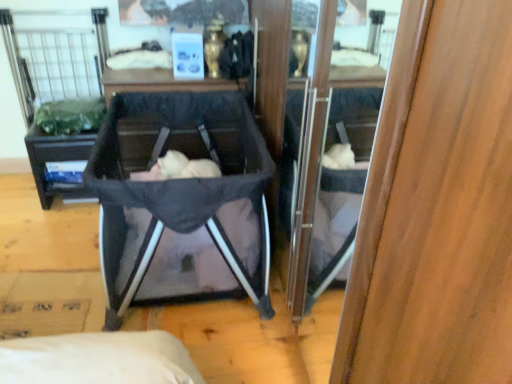
Question: Which is correct: wooden cabinet at center is inside soft pink fabric at center, or outside of it?

Choices:
 (A) inside
 (B) outside

Answer: (B)

Question: In terms of width, does wooden cabinet at center look wider or thinner when compared to soft pink fabric at center?

Choices:
 (A) wide
 (B) thin

Answer: (B)

Question: Which is nearer to the dark gray fabric baby carriage at center?

Choices:
 (A) black matte vanity at center
 (B) soft pink fabric at center
 (C) wooden cabinet at center

Answer: (B)

Question: Which of these objects is positioned closest to the wooden cabinet at center?

Choices:
 (A) soft pink fabric at center
 (B) dark gray fabric baby carriage at center
 (C) black matte vanity at center

Answer: (A)